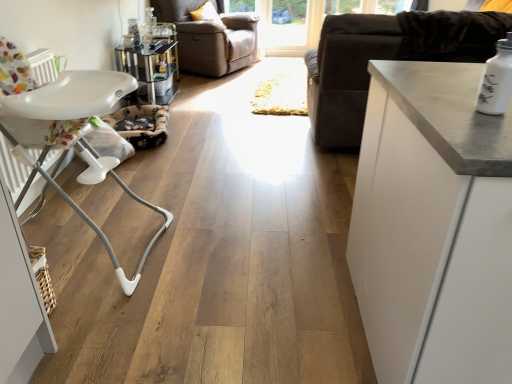
Image resolution: width=512 pixels, height=384 pixels. What are the coordinates of `vacant region under white plastic highchair at left (from a real-world perspective)` in the screenshot? It's located at (89, 238).